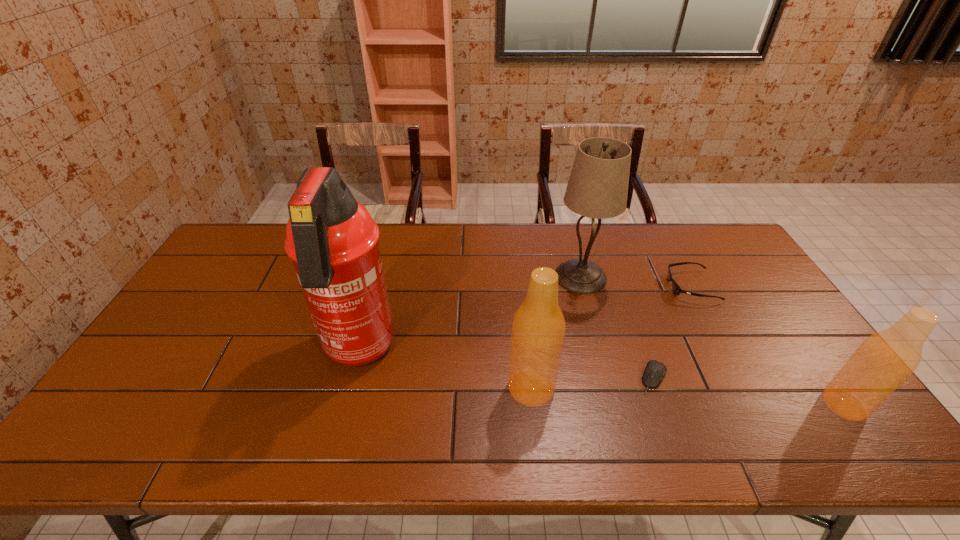
Identify which object is the third closest to the second object from left to right. Please provide its 2D coordinates. Your answer should be formatted as a tuple, i.e. [(x, y)], where the tuple contains the x and y coordinates of a point satisfying the conditions above.

[(332, 240)]

Where is `free space that satisfies the following two spatial constraints: 1. on the front-facing side of the lampshade; 2. on the right side of the computer mouse`? The height and width of the screenshot is (540, 960). free space that satisfies the following two spatial constraints: 1. on the front-facing side of the lampshade; 2. on the right side of the computer mouse is located at coordinates (607, 377).

The width and height of the screenshot is (960, 540). Find the location of `vacant region that satisfies the following two spatial constraints: 1. on the front-facing side of the lampshade; 2. on the left side of the computer mouse`. vacant region that satisfies the following two spatial constraints: 1. on the front-facing side of the lampshade; 2. on the left side of the computer mouse is located at coordinates [x=607, y=377].

Identify the location of free point that satisfies the following two spatial constraints: 1. on the front-facing side of the lampshade; 2. on the trigger side of the fire extinguisher. [x=600, y=352].

Locate an element on the screen. The image size is (960, 540). free space that satisfies the following two spatial constraints: 1. on the front-facing side of the fifth object from left to right; 2. on the right side of the rightmost object is located at coordinates (755, 404).

Where is `vacant space that satisfies the following two spatial constraints: 1. on the trigger side of the leftmost object; 2. on the right side of the computer mouse`? This screenshot has height=540, width=960. vacant space that satisfies the following two spatial constraints: 1. on the trigger side of the leftmost object; 2. on the right side of the computer mouse is located at coordinates (351, 377).

You are a GUI agent. You are given a task and a screenshot of the screen. Output one action in this format:
    pyautogui.click(x=<x>, y=<y>)
    Task: Click on the vacant space that satisfies the following two spatial constraints: 1. on the back side of the computer mouse; 2. on the front-facing side of the lampshade
    This screenshot has height=540, width=960.
    Given the screenshot: What is the action you would take?
    pyautogui.click(x=617, y=276)